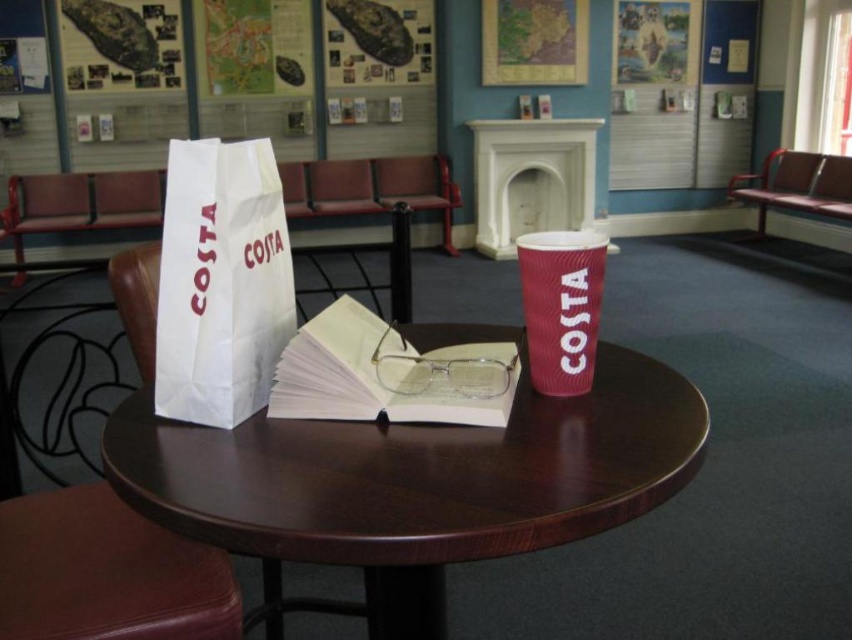
Question: In this image, where is wooden round table at center located relative to white paper bag at center?

Choices:
 (A) above
 (B) below

Answer: (B)

Question: Which point appears closest to the camera in this image?

Choices:
 (A) (591, 369)
 (B) (360, 340)

Answer: (A)

Question: Which object is closer to the camera taking this photo?

Choices:
 (A) white paper bag at center
 (B) matte red cup at center

Answer: (A)

Question: Is white paper bag at center thinner than light yellow paper book at center?

Choices:
 (A) no
 (B) yes

Answer: (B)

Question: Can you confirm if white paper bag at center is wider than matte red cup at center?

Choices:
 (A) no
 (B) yes

Answer: (B)

Question: Which of the following is the farthest from the observer?

Choices:
 (A) (314, 358)
 (B) (639, 426)
 (C) (208, 202)

Answer: (A)